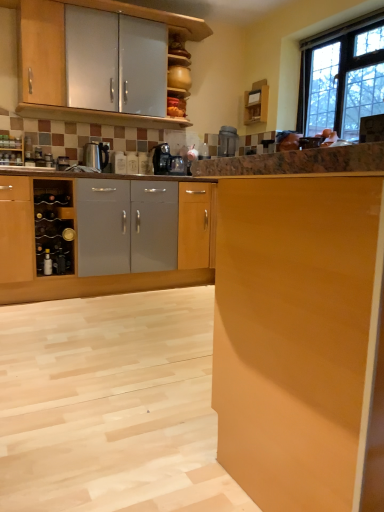
Question: Considering the positions of metallic silver toaster at upper center, the 1th appliance positioned from the right, and metallic silver wine rack at left, placed as the first appliance when sorted from left to right, in the image, is metallic silver toaster at upper center, the 1th appliance positioned from the right, wider or thinner than metallic silver wine rack at left, placed as the first appliance when sorted from left to right,?

Choices:
 (A) wide
 (B) thin

Answer: (A)

Question: Is metallic silver toaster at upper center, which is the second appliance in front-to-back order, situated inside metallic silver wine rack at left, the second appliance viewed from the back, or outside?

Choices:
 (A) outside
 (B) inside

Answer: (A)

Question: Which of these objects is positioned closest to the light wood cabinet at lower left, the 1th cabinetry when ordered from bottom to top?

Choices:
 (A) black plastic coffee machine at center
 (B) metallic silver bottle at lower left
 (C) metallic silver wine rack at left, the 2th appliance viewed from the right
 (D) metallic silver toaster at upper center, the 1th appliance positioned from the right
 (E) clear glass window at upper right

Answer: (B)

Question: Which object is positioned closest to the matte wood cabinet at right, the 3th cabinetry when ordered from back to front?

Choices:
 (A) black plastic coffee machine at center
 (B) light wood cabinet at lower left, the 2th cabinetry from the back
 (C) metallic silver toaster at upper center, which is the second appliance in front-to-back order
 (D) metallic silver wine rack at left, the 2th appliance when ordered from top to bottom
 (E) metallic silver bottle at lower left

Answer: (B)